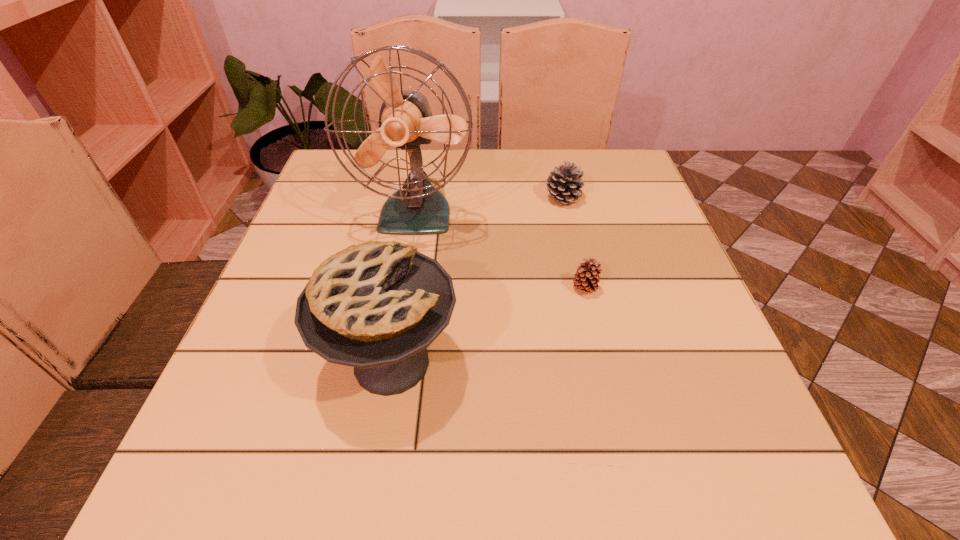
Point out which object is positioned as the third nearest to the fan. Please provide its 2D coordinates. Your answer should be formatted as a tuple, i.e. [(x, y)], where the tuple contains the x and y coordinates of a point satisfying the conditions above.

[(586, 279)]

You are a GUI agent. You are given a task and a screenshot of the screen. Output one action in this format:
    pyautogui.click(x=<x>, y=<y>)
    Task: Click on the vacant space that satisfies the following two spatial constraints: 1. on the front-facing side of the shortest object for air flow; 2. on the right side of the tallest object
    The width and height of the screenshot is (960, 540).
    Given the screenshot: What is the action you would take?
    pyautogui.click(x=404, y=289)

The height and width of the screenshot is (540, 960). In order to click on free space that satisfies the following two spatial constraints: 1. on the front-facing side of the tallest object for air flow; 2. on the left side of the nearer pinecone in this screenshot , I will do `click(404, 289)`.

Locate an element on the screen. The image size is (960, 540). free space that satisfies the following two spatial constraints: 1. on the front-facing side of the nearer pinecone for air flow; 2. on the left side of the fan is located at coordinates (404, 289).